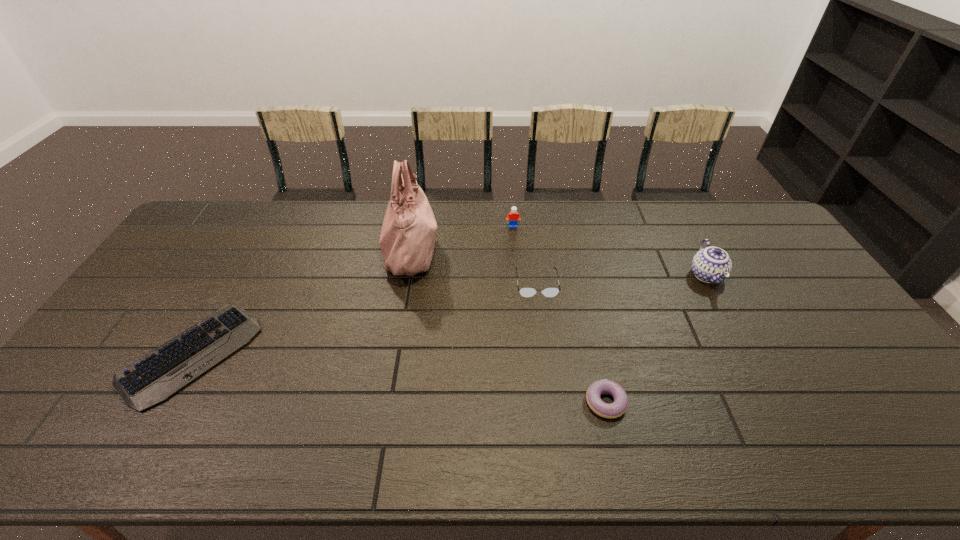
Where is `vacant space located at the front of the tallest object with handles`? The image size is (960, 540). vacant space located at the front of the tallest object with handles is located at coordinates [558, 249].

You are a GUI agent. You are given a task and a screenshot of the screen. Output one action in this format:
    pyautogui.click(x=<x>, y=<y>)
    Task: Click on the free space located 0.270m at the spout of the rightmost object
    This screenshot has width=960, height=540.
    Given the screenshot: What is the action you would take?
    pyautogui.click(x=758, y=372)

Where is `vacant space located on the face of the third tallest object`? vacant space located on the face of the third tallest object is located at coordinates (516, 270).

Image resolution: width=960 pixels, height=540 pixels. In order to click on vacant area situated on the lenses of the spectacles in this screenshot , I will do `click(540, 313)`.

At what (x,y) coordinates should I click in order to perform the action: click on vacant area located 0.330m on the right of the second shortest object. Please return your answer as a coordinate pair (x, y). This screenshot has width=960, height=540. Looking at the image, I should click on (760, 402).

This screenshot has height=540, width=960. Find the location of `free space located 0.210m on the back of the computer keyboard`. free space located 0.210m on the back of the computer keyboard is located at coordinates (247, 260).

Where is `handbag that is at the far edge`? handbag that is at the far edge is located at coordinates (407, 239).

This screenshot has height=540, width=960. Identify the location of Lego that is at the far edge. (513, 217).

Locate an element on the screen. Image resolution: width=960 pixels, height=540 pixels. object at the left edge is located at coordinates (156, 376).

Where is `vacant space at the far edge of the desktop`? Image resolution: width=960 pixels, height=540 pixels. vacant space at the far edge of the desktop is located at coordinates 635,238.